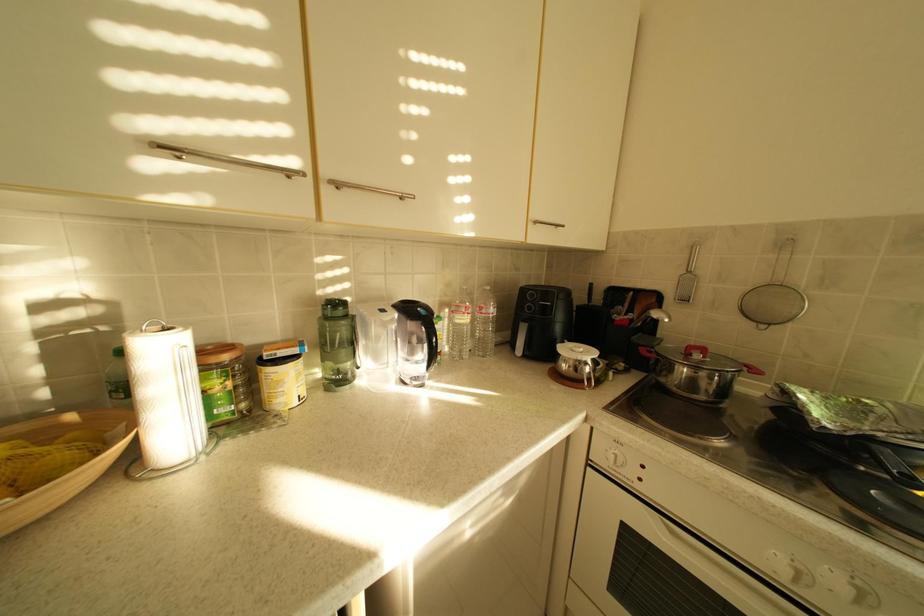
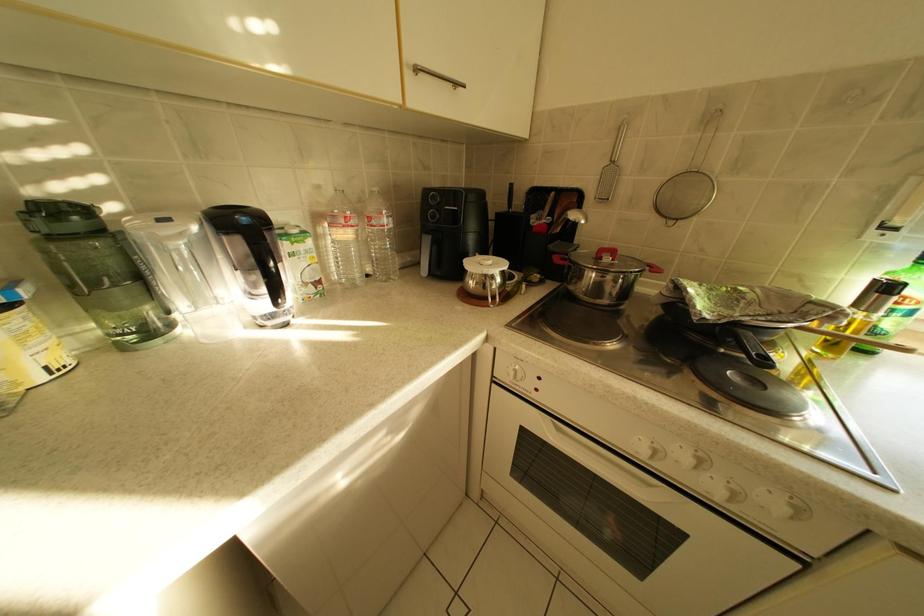
Question: Based on the continuous images, in which direction is the camera rotating? Reply with the corresponding letter.

Choices:
 (A) Left
 (B) Right
 (C) Up
 (D) Down

Answer: (D)